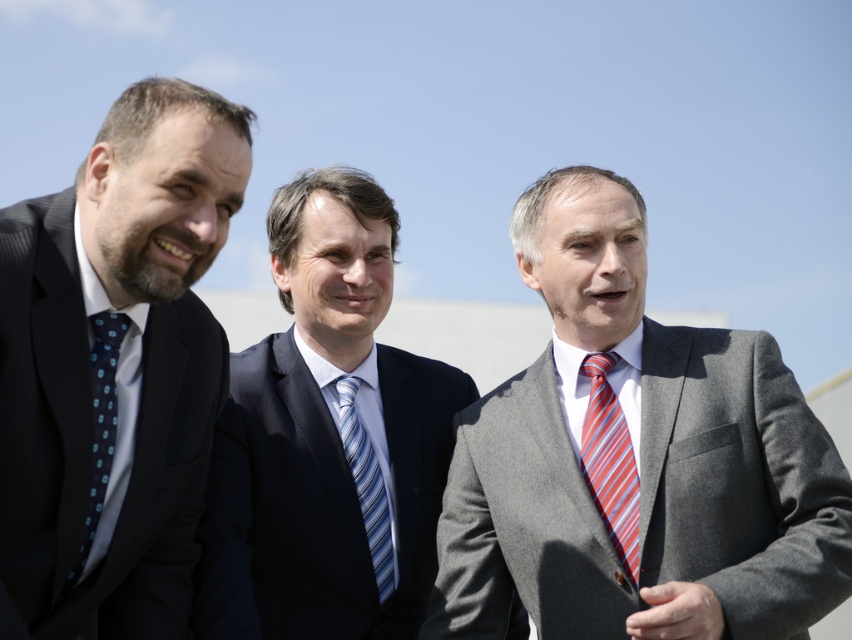
Does navy blue suit at center have a lesser height compared to blue dotted tie at left?

In fact, navy blue suit at center may be taller than blue dotted tie at left.

Does navy blue suit at center have a larger size compared to blue dotted tie at left?

Correct, navy blue suit at center is larger in size than blue dotted tie at left.

Is point (403, 509) positioned in front of point (102, 468)?

No.

I want to click on navy blue suit at center, so click(326, 440).

Looking at this image, is gray wool suit at center thinner than blue striped tie at center?

Yes.

Between gray wool suit at center and blue striped tie at center, which one has less height?

With less height is gray wool suit at center.

Between point (597, 252) and point (381, 509), which one is positioned in front?

Positioned in front is point (597, 252).

You are a GUI agent. You are given a task and a screenshot of the screen. Output one action in this format:
    pyautogui.click(x=<x>, y=<y>)
    Task: Click on the gray wool suit at center
    Image resolution: width=852 pixels, height=640 pixels.
    Given the screenshot: What is the action you would take?
    pyautogui.click(x=636, y=460)

Is dark blue pinstripe suit at left wider than navy blue suit at center?

In fact, dark blue pinstripe suit at left might be narrower than navy blue suit at center.

The width and height of the screenshot is (852, 640). Describe the element at coordinates (114, 368) in the screenshot. I see `dark blue pinstripe suit at left` at that location.

Where is `dark blue pinstripe suit at left`? dark blue pinstripe suit at left is located at coordinates (114, 368).